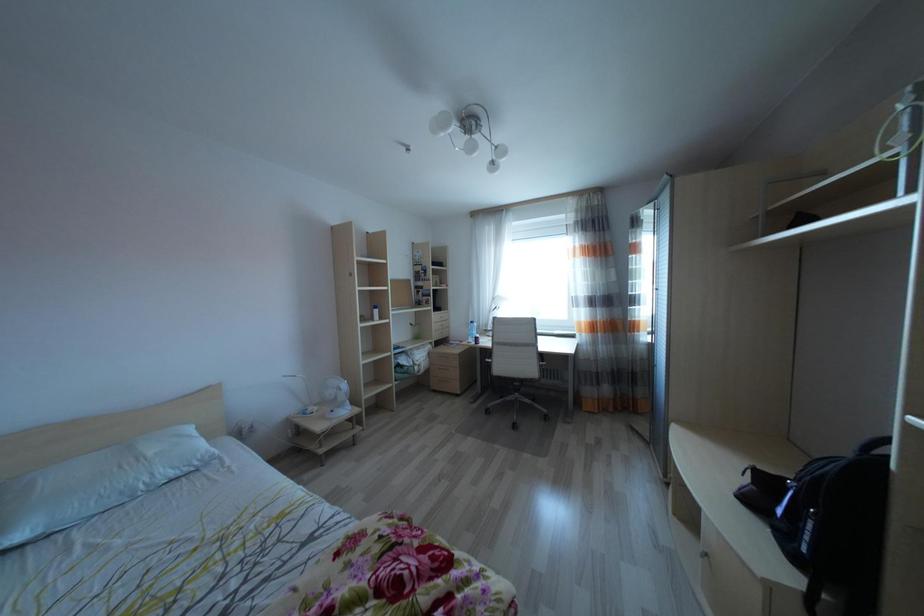
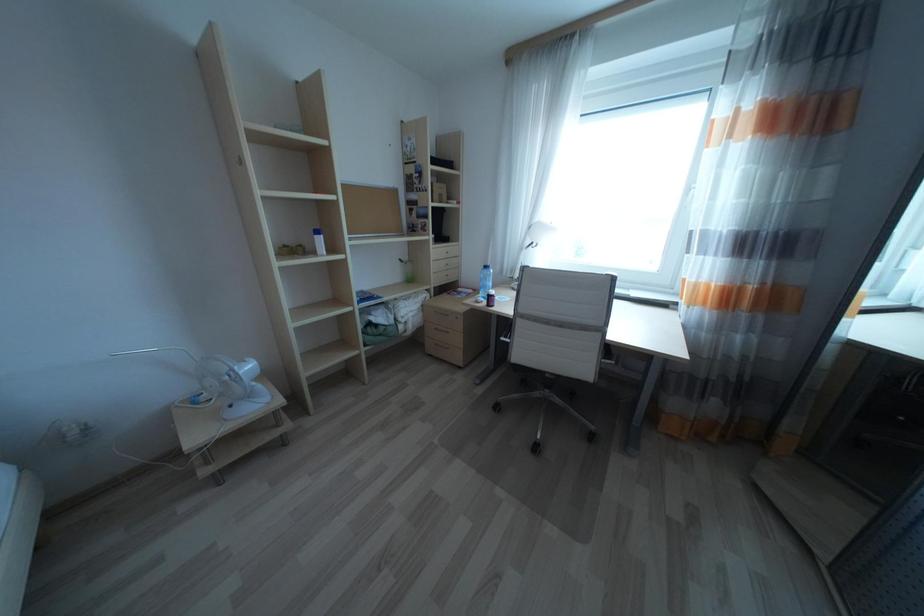
Question: What movement of the cameraman would produce the second image?

Choices:
 (A) Left
 (B) Right
 (C) Forward
 (D) Backward

Answer: (C)